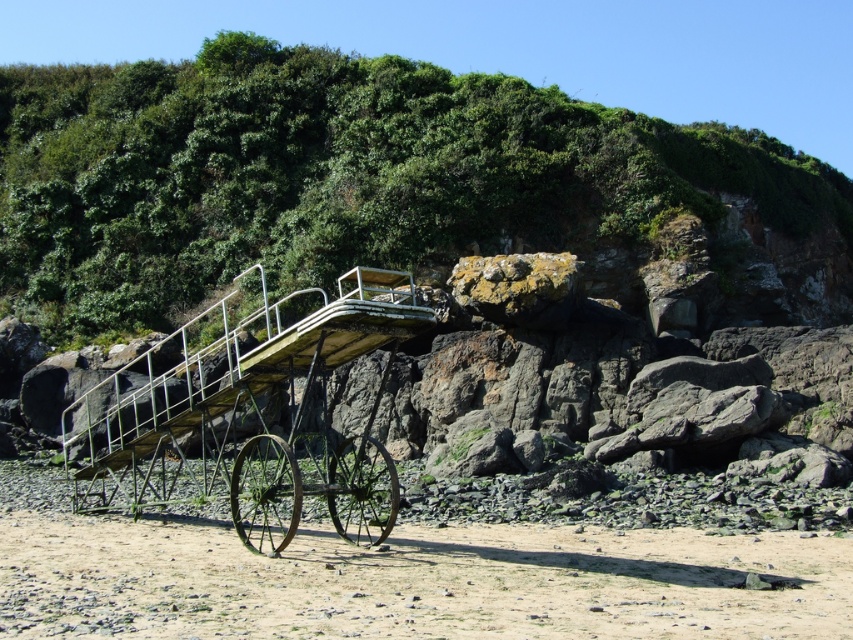
You are a hiker who just arrived at the beach. You need to cross the brown sandy beach at lower center to reach the green metal cart at center. Can you walk directly from the beach to the cart without stepping on any rocks?

The brown sandy beach at lower center is wider than the green metal cart at center, so yes, you can walk directly from the beach to the cart without stepping on any rocks.

You are standing on the rustic, vintage cart on the rocky beach. You notice a point marked at coordinates [334,176]. What is located at that point?

The point at [334,176] marks green leafy vegetation at upper center.